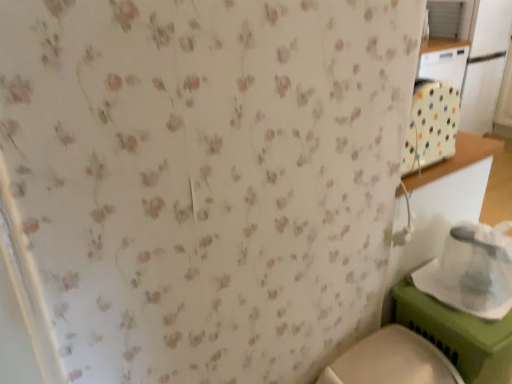
This screenshot has width=512, height=384. What do you see at coordinates (472, 270) in the screenshot?
I see `white plastic container at lower right` at bounding box center [472, 270].

Measure the distance between point (471, 291) and camera.

The distance of point (471, 291) from camera is 3.58 feet.

Where is `white plastic container at lower right`? This screenshot has height=384, width=512. white plastic container at lower right is located at coordinates (472, 270).

The image size is (512, 384). What do you see at coordinates (391, 361) in the screenshot?
I see `white glossy toilet at lower right` at bounding box center [391, 361].

You are a GUI agent. You are given a task and a screenshot of the screen. Output one action in this format:
    pyautogui.click(x=<x>, y=<y>)
    Task: Click on the white glossy toilet at lower right
    
    Given the screenshot: What is the action you would take?
    pyautogui.click(x=391, y=361)

Locate an element on the screen. white plastic container at lower right is located at coordinates (472, 270).

Considering the relative positions of white plastic container at lower right and white glossy toilet at lower right in the image provided, is white plastic container at lower right to the left of white glossy toilet at lower right from the viewer's perspective?

In fact, white plastic container at lower right is to the right of white glossy toilet at lower right.

Which is in front, white plastic container at lower right or white glossy toilet at lower right?

white glossy toilet at lower right is more forward.

Is point (481, 246) positioned after point (388, 382)?

Yes, point (481, 246) is farther from viewer.

From the image's perspective, is white plastic container at lower right above white glossy toilet at lower right?

Yes, from the image's perspective, white plastic container at lower right is above white glossy toilet at lower right.

From a real-world perspective, which object rests below the other?

From a 3D spatial view, white glossy toilet at lower right is below.

From the picture: Can you confirm if white plastic container at lower right is thinner than white glossy toilet at lower right?

Yes.

Can you confirm if white plastic container at lower right is shorter than white glossy toilet at lower right?

Correct, white plastic container at lower right is not as tall as white glossy toilet at lower right.

Considering the relative sizes of white plastic container at lower right and white glossy toilet at lower right in the image provided, is white plastic container at lower right bigger than white glossy toilet at lower right?

No, white plastic container at lower right is not bigger than white glossy toilet at lower right.

Would you say white plastic container at lower right is inside or outside white glossy toilet at lower right?

white plastic container at lower right exists outside the volume of white glossy toilet at lower right.

Is white plastic container at lower right in contact with white glossy toilet at lower right?

No, white plastic container at lower right is not next to white glossy toilet at lower right.

Looking at this image, could you tell me if white plastic container at lower right is turned towards white glossy toilet at lower right?

No, white plastic container at lower right does not turn towards white glossy toilet at lower right.

At what (x,y) coordinates should I click in order to perform the action: click on toilet located below the white plastic container at lower right (from the image's perspective). Please return your answer as a coordinate pair (x, y). The height and width of the screenshot is (384, 512). Looking at the image, I should click on (391, 361).

Considering the relative positions of white glossy toilet at lower right and white plastic container at lower right in the image provided, is white glossy toilet at lower right to the left of white plastic container at lower right from the viewer's perspective?

Indeed, white glossy toilet at lower right is positioned on the left side of white plastic container at lower right.

Is the depth of white glossy toilet at lower right greater than that of white plastic container at lower right?

That is False.

Which is less distant, (329, 367) or (468, 272)?

The point (468, 272) is closer.

From the image's perspective, which one is positioned higher, white glossy toilet at lower right or white plastic container at lower right?

white plastic container at lower right appears higher in the image.

From a real-world perspective, does white glossy toilet at lower right stand above white plastic container at lower right?

Actually, white glossy toilet at lower right is physically below white plastic container at lower right in the real world.

Considering the relative sizes of white glossy toilet at lower right and white plastic container at lower right in the image provided, is white glossy toilet at lower right wider than white plastic container at lower right?

Indeed, white glossy toilet at lower right has a greater width compared to white plastic container at lower right.

Which of these two, white glossy toilet at lower right or white plastic container at lower right, stands shorter?

white plastic container at lower right is shorter.

Considering the sizes of objects white glossy toilet at lower right and white plastic container at lower right in the image provided, who is smaller, white glossy toilet at lower right or white plastic container at lower right?

Smaller between the two is white plastic container at lower right.

Is white glossy toilet at lower right not within white plastic container at lower right?

white glossy toilet at lower right is positioned outside white plastic container at lower right.

Consider the image. Does white glossy toilet at lower right touch white plastic container at lower right?

No, white glossy toilet at lower right is not beside white plastic container at lower right.

Is white glossy toilet at lower right turned away from white plastic container at lower right?

white glossy toilet at lower right does not have its back to white plastic container at lower right.

How many degrees apart are the facing directions of white glossy toilet at lower right and white plastic container at lower right?

0.000178 degrees.

This screenshot has height=384, width=512. What are the coordinates of `toilet in front of the white plastic container at lower right` in the screenshot? It's located at (391, 361).

At what (x,y) coordinates should I click in order to perform the action: click on appliance above the white glossy toilet at lower right (from a real-world perspective). Please return your answer as a coordinate pair (x, y). The image size is (512, 384). Looking at the image, I should click on (472, 270).

This screenshot has width=512, height=384. Identify the location of toilet on the left of white plastic container at lower right. (391, 361).